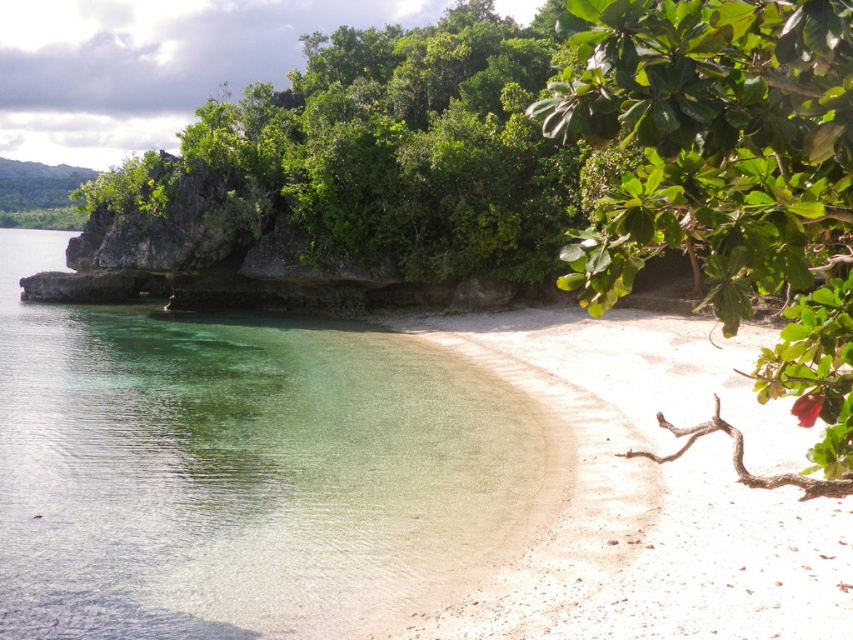
Question: Estimate the real-world distances between objects in this image. Which object is farther from the green leafy rock at upper left?

Choices:
 (A) green leafy tree at upper right
 (B) clear water at lower left

Answer: (A)

Question: Based on their relative distances, which object is nearer to the clear water at lower left?

Choices:
 (A) white sandy beach at lower right
 (B) green leafy rock at upper left
 (C) green leafy tree at upper right

Answer: (A)

Question: Among these points, which one is farthest from the camera?

Choices:
 (A) (444, 264)
 (B) (556, 324)
 (C) (24, 497)
 (D) (740, 173)

Answer: (A)

Question: Observing the image, what is the correct spatial positioning of white sandy beach at lower right in reference to green leafy rock at upper left?

Choices:
 (A) left
 (B) right

Answer: (B)

Question: Observing the image, what is the correct spatial positioning of green leafy tree at upper right in reference to green leafy rock at upper left?

Choices:
 (A) above
 (B) below

Answer: (B)

Question: From the image, what is the correct spatial relationship of white sandy beach at lower right in relation to green leafy rock at upper left?

Choices:
 (A) below
 (B) above

Answer: (A)